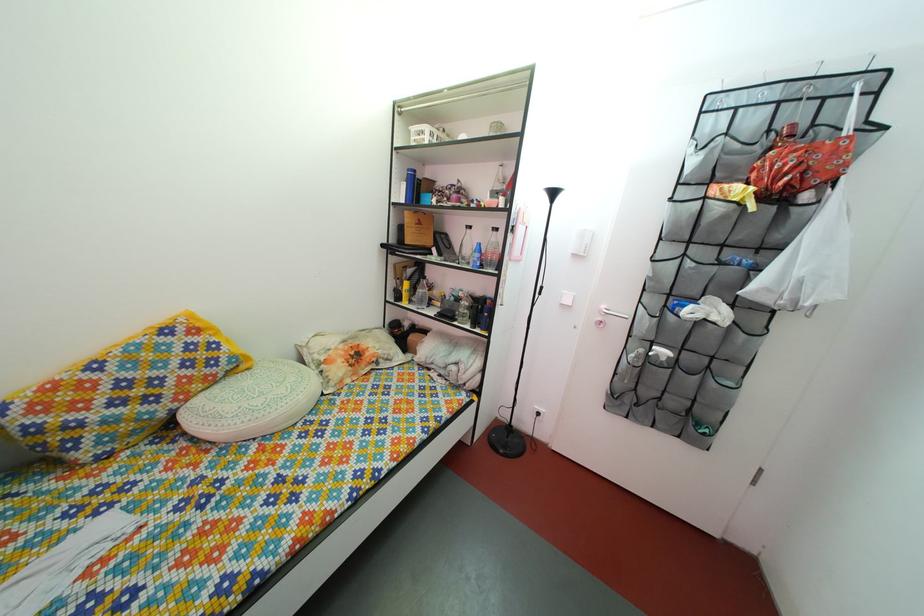
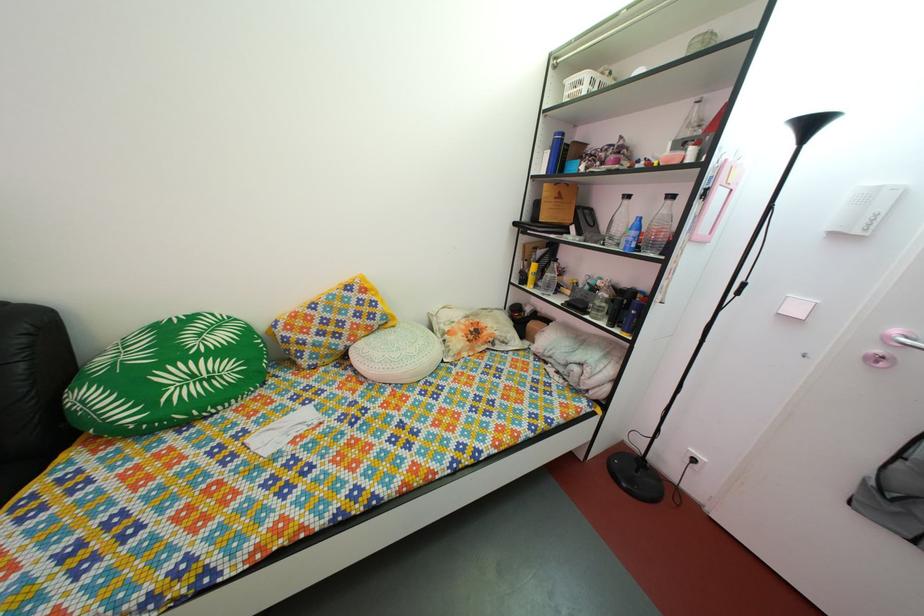
Question: The camera is either moving clockwise (left) or counter-clockwise (right) around the object. The first image is from the beginning of the video and the second image is from the end. Is the camera moving left or right when shooting the video?

Choices:
 (A) Left
 (B) Right

Answer: (B)